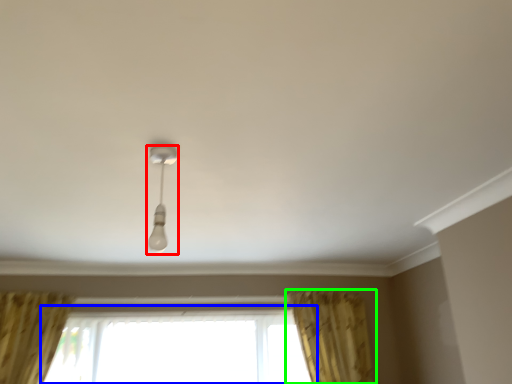
Question: Which is nearer to the lamp (highlighted by a red box)? window (highlighted by a blue box) or curtain (highlighted by a green box).

Choices:
 (A) window
 (B) curtain

Answer: (A)